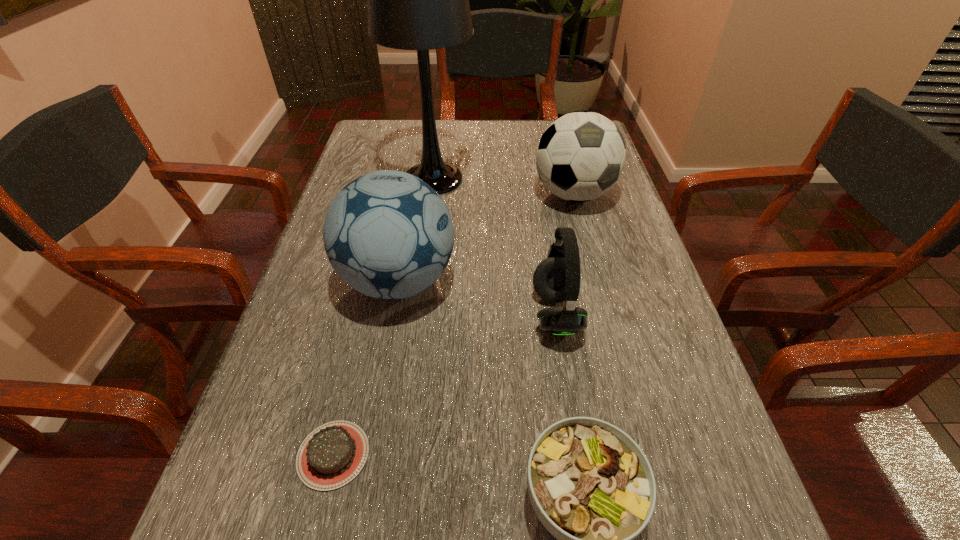
You are a GUI agent. You are given a task and a screenshot of the screen. Output one action in this format:
    pyautogui.click(x=<x>, y=<y>)
    Task: Click on the blank space located 0.210m on the ear cups of the headset
    Image resolution: width=960 pixels, height=540 pixels.
    Given the screenshot: What is the action you would take?
    pyautogui.click(x=427, y=314)

Where is `vacant space located 0.230m on the right of the chocolate cake`? The height and width of the screenshot is (540, 960). vacant space located 0.230m on the right of the chocolate cake is located at coordinates (518, 455).

At what (x,y) coordinates should I click in order to perform the action: click on object at the far edge. Please return your answer as a coordinate pair (x, y). The image size is (960, 540). Looking at the image, I should click on (418, 0).

At what (x,y) coordinates should I click in order to perform the action: click on table lamp that is at the left edge. Please return your answer as a coordinate pair (x, y). The height and width of the screenshot is (540, 960). Looking at the image, I should click on (418, 0).

You are a GUI agent. You are given a task and a screenshot of the screen. Output one action in this format:
    pyautogui.click(x=<x>, y=<y>)
    Task: Click on the soccer ball that is at the left edge
    This screenshot has width=960, height=540.
    Given the screenshot: What is the action you would take?
    pyautogui.click(x=389, y=235)

Identify the location of chocolate cake present at the left edge. The height and width of the screenshot is (540, 960). (x=332, y=455).

The width and height of the screenshot is (960, 540). I want to click on object present at the right edge, so click(x=580, y=156).

This screenshot has width=960, height=540. In order to click on object that is at the far left corner in this screenshot , I will do `click(418, 0)`.

Image resolution: width=960 pixels, height=540 pixels. Find the location of `vacant space at the far edge of the desktop`. vacant space at the far edge of the desktop is located at coordinates (486, 148).

Locate an element on the screen. The height and width of the screenshot is (540, 960). free spot at the left edge of the desktop is located at coordinates pyautogui.click(x=234, y=468).